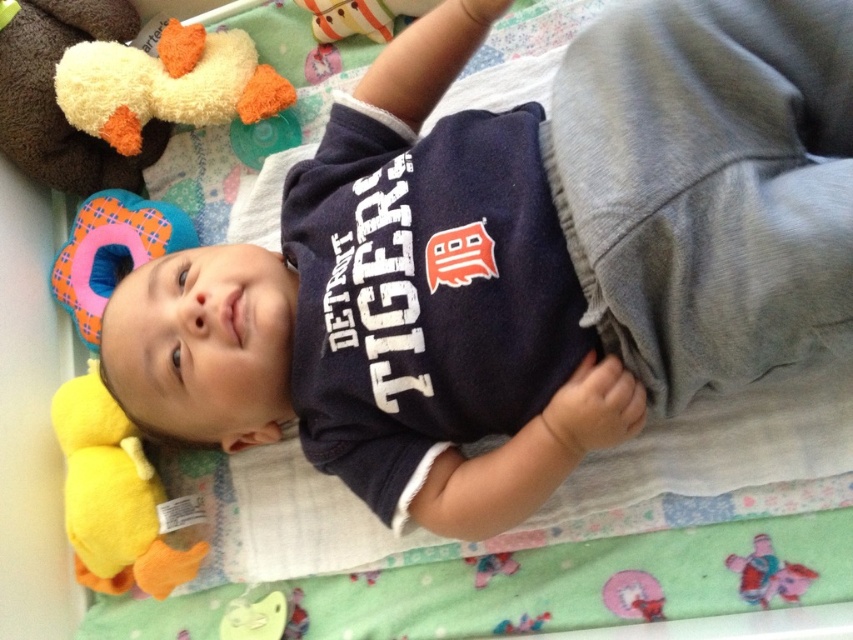
Where is the fluffy yellow duck at upper left located in the image?

The fluffy yellow duck at upper left is located at point (166, 83).

You are a parent trying to organize the baby toys. You need to place the yellow plush duck at lower left and the striped plush toy at upper center into a storage box. Which toy requires a wider space in the box?

The yellow plush duck at lower left requires a wider space in the box because its width surpasses that of the striped plush toy at upper center.

You are a parent checking the safety of the baby area. The fluffy yellow duck at upper left and the red plush elephant at lower right are both within the baby playpen. Which toy is taller?

The fluffy yellow duck at upper left is taller than the red plush elephant at lower right according to the description.